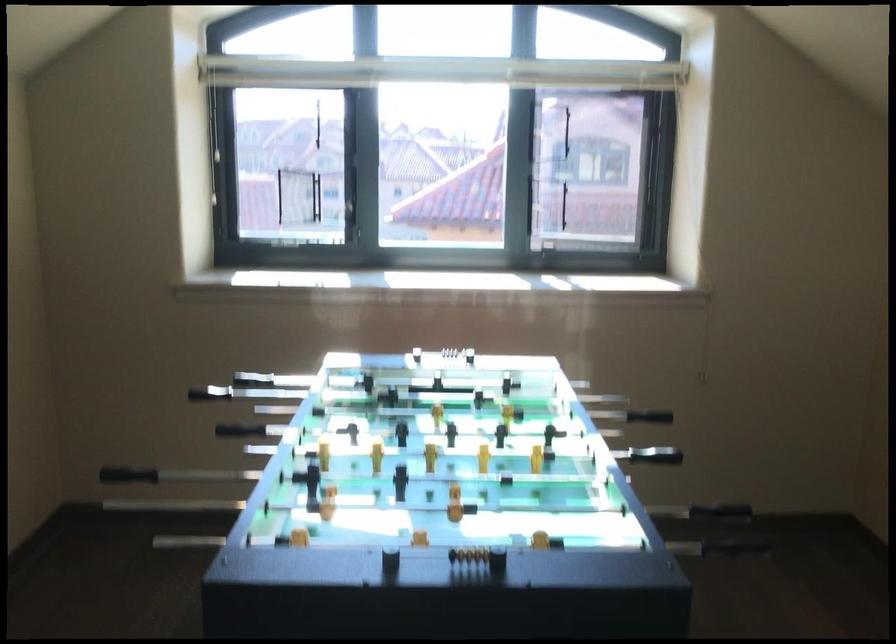
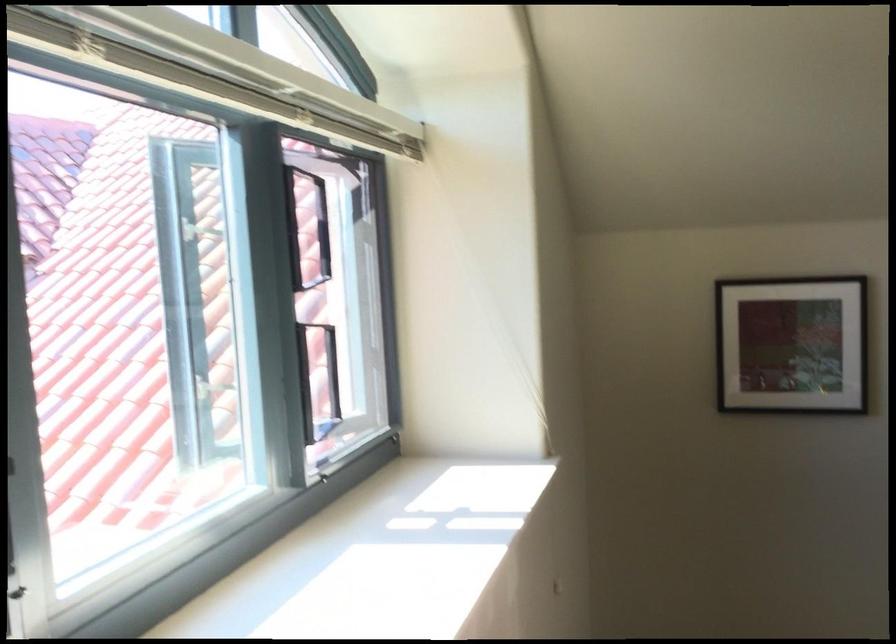
In the second image, find the point that corresponds to (x=682, y=169) in the first image.

(483, 298)